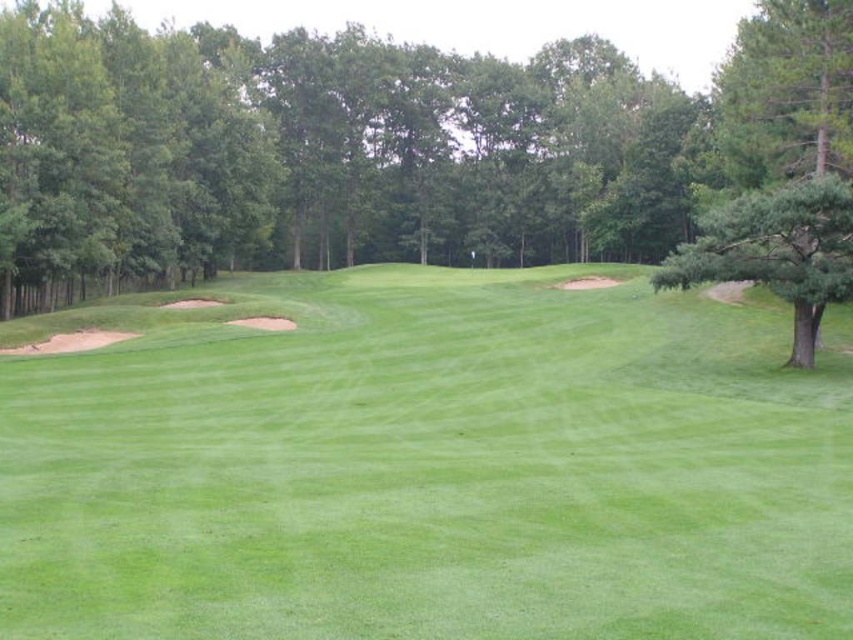
Does green leafy tree at center appear over green textured tree at right?

Yes, green leafy tree at center is above green textured tree at right.

Is green leafy tree at center thinner than green textured tree at right?

In fact, green leafy tree at center might be wider than green textured tree at right.

Who is more forward, (129, 273) or (779, 260)?

Point (779, 260) is more forward.

Where is `green leafy tree at center`? The image size is (853, 640). green leafy tree at center is located at coordinates tap(422, 154).

Does green grassy fairway at lower left have a lesser width compared to green textured tree at right?

In fact, green grassy fairway at lower left might be wider than green textured tree at right.

Who is more distant from viewer, (514, 337) or (700, 220)?

Positioned behind is point (700, 220).

You are a GUI agent. You are given a task and a screenshot of the screen. Output one action in this format:
    pyautogui.click(x=<x>, y=<y>)
    Task: Click on the green grassy fairway at lower left
    This screenshot has width=853, height=640.
    Given the screenshot: What is the action you would take?
    pyautogui.click(x=427, y=465)

Is point (0, 566) more distant than point (320, 92)?

No, it is in front of (320, 92).

Who is positioned more to the right, green grassy fairway at lower left or green leafy tree at center?

green leafy tree at center is more to the right.

Between point (592, 541) and point (1, 108), which one is positioned in front?

Point (592, 541) is in front.

Where is `green grassy fairway at lower left`? The image size is (853, 640). green grassy fairway at lower left is located at coordinates (427, 465).